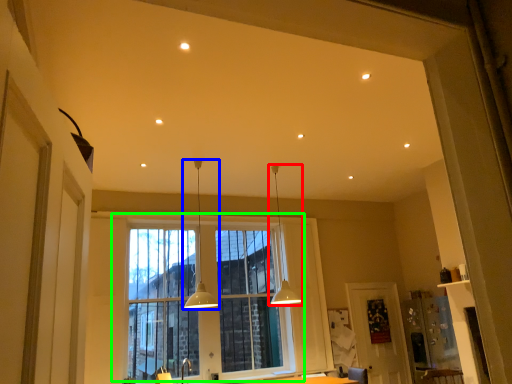
Question: Estimate the real-world distances between objects in this image. Which object is closer to lamp (highlighted by a red box), lamp (highlighted by a blue box) or window (highlighted by a green box)?

Choices:
 (A) lamp
 (B) window

Answer: (B)